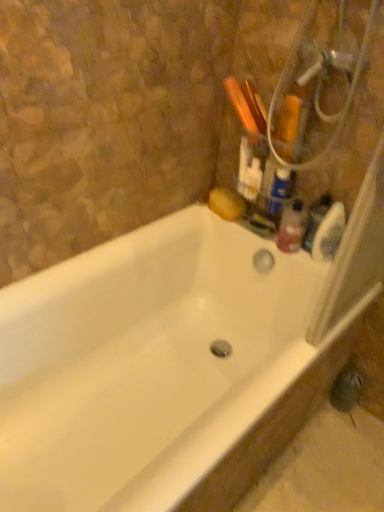
Question: Choose the correct answer: Is translucent plastic soap dispenser at upper right inside white glossy bathtub at upper right or outside it?

Choices:
 (A) outside
 (B) inside

Answer: (A)

Question: Looking at their shapes, would you say translucent plastic soap dispenser at upper right is wider or thinner than white glossy bathtub at upper right?

Choices:
 (A) wide
 (B) thin

Answer: (B)

Question: Estimate the real-world distances between objects in this image. Which object is closer to the translucent plastic bottle at upper right, placed as the 1th cleaning product when sorted from bottom to top?

Choices:
 (A) metallic silver showerhead at upper right
 (B) translucent plastic soap dispenser at upper right
 (C) translucent plastic bottle at upper right, marked as the second cleaning product in a bottom-to-top arrangement
 (D) white glossy bathtub at upper right

Answer: (B)

Question: Considering the real-world distances, which object is farthest from the metallic silver showerhead at upper right?

Choices:
 (A) translucent plastic bottle at upper right, which ranks as the 1th cleaning product in top-to-bottom order
 (B) translucent plastic soap dispenser at upper right
 (C) translucent plastic bottle at upper right, the second cleaning product in the top-to-bottom sequence
 (D) white glossy bathtub at upper right

Answer: (D)